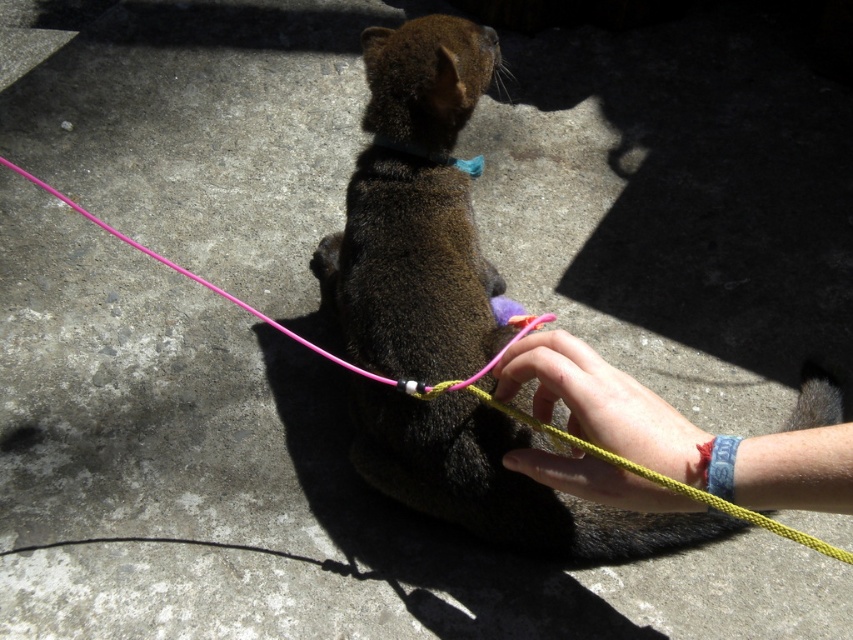
Is smooth yellow rope at center positioned in front of pink nylon leash at center?

No, it is not.

Between point (543, 403) and point (735, 513), which one is positioned in front?

Point (735, 513) is in front.

Find the location of a particular element. The image size is (853, 640). smooth yellow rope at center is located at coordinates (602, 404).

Is smooth yellow rope at center below blue fabric neckband at center?

Yes.

Who is more forward, (628, 381) or (415, 148)?

Point (628, 381) is more forward.

The height and width of the screenshot is (640, 853). Describe the element at coordinates (602, 404) in the screenshot. I see `smooth yellow rope at center` at that location.

Where is `smooth yellow rope at center`? smooth yellow rope at center is located at coordinates point(602,404).

What do you see at coordinates (474, 390) in the screenshot? I see `pink nylon leash at center` at bounding box center [474, 390].

Who is taller, pink nylon leash at center or blue fabric neckband at center?

pink nylon leash at center

This screenshot has height=640, width=853. Describe the element at coordinates (474, 390) in the screenshot. I see `pink nylon leash at center` at that location.

At what (x,y) coordinates should I click in order to perform the action: click on pink nylon leash at center. Please return your answer as a coordinate pair (x, y). Image resolution: width=853 pixels, height=640 pixels. Looking at the image, I should click on (474, 390).